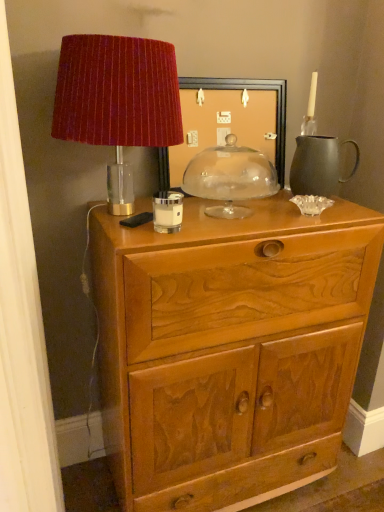
Locate an element on the screen. This screenshot has width=384, height=512. vacant space situated on the left part of matte black pitcher at right is located at coordinates (278, 200).